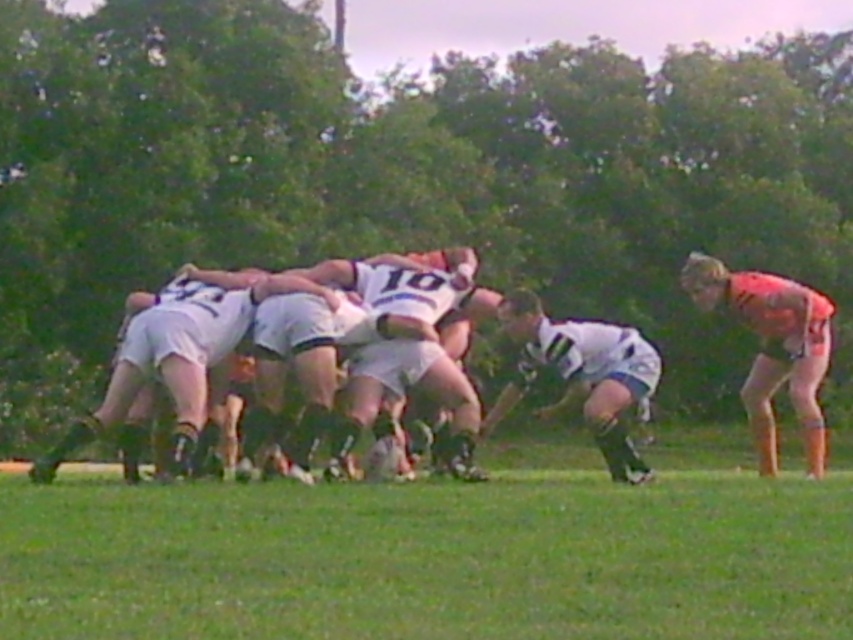
You are a rugby coach analyzing the scrum formation. You notice the orange jersey at right and the white matte jersey at center. Which player has a larger jersey size?

The orange jersey at right is bigger than the white matte jersey at center, so the player wearing the orange jersey at right has a larger jersey size.

You are a sports analyst observing a rugby scrum. You notice two white items at the center of the field. Which one is bigger in size between the white matte shorts at center and the white matte jersey at center?

The white matte shorts at center has a larger size compared to the white matte jersey at center.